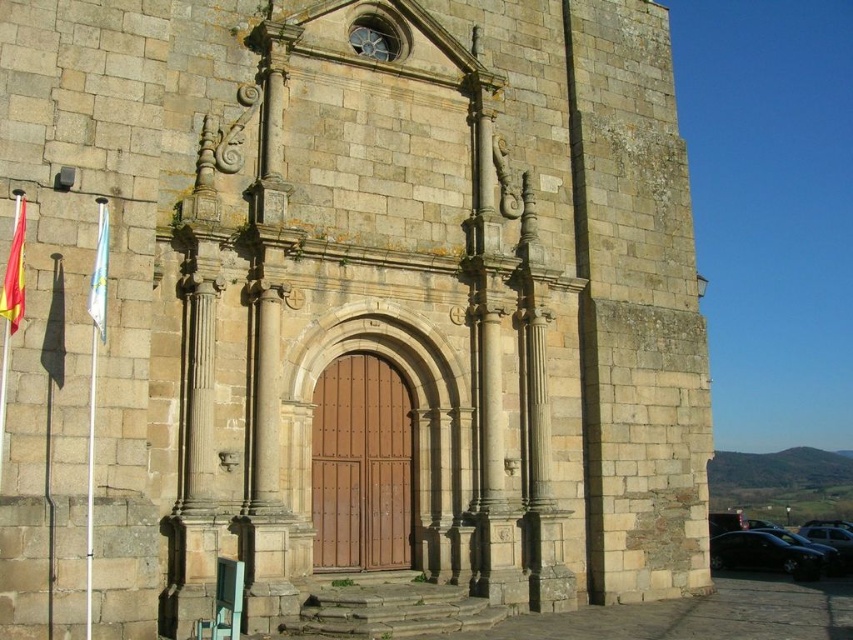
Does shiny black car at lower right appear on the left side of white fabric flag at left?

Incorrect, shiny black car at lower right is not on the left side of white fabric flag at left.

Does shiny black car at lower right lie behind white fabric flag at left?

That is True.

What do you see at coordinates (763, 554) in the screenshot? I see `shiny black car at lower right` at bounding box center [763, 554].

Where is `shiny black car at lower right`? shiny black car at lower right is located at coordinates (763, 554).

Who is more distant from viewer, (813, 552) or (16, 230)?

Positioned behind is point (813, 552).

Which is below, shiny black car at lower right or red fabric flag at left?

Positioned lower is shiny black car at lower right.

Who is more forward, (732, 540) or (6, 282)?

Positioned in front is point (6, 282).

Locate an element on the screen. The width and height of the screenshot is (853, 640). shiny black car at lower right is located at coordinates (763, 554).

Who is positioned more to the left, red fabric flag at left or white fabric flag at left?

red fabric flag at left is more to the left.

Does red fabric flag at left appear under white fabric flag at left?

Yes, red fabric flag at left is below white fabric flag at left.

Does point (13, 330) come in front of point (105, 330)?

Yes, it is in front of point (105, 330).

Locate an element on the screen. The width and height of the screenshot is (853, 640). red fabric flag at left is located at coordinates (15, 272).